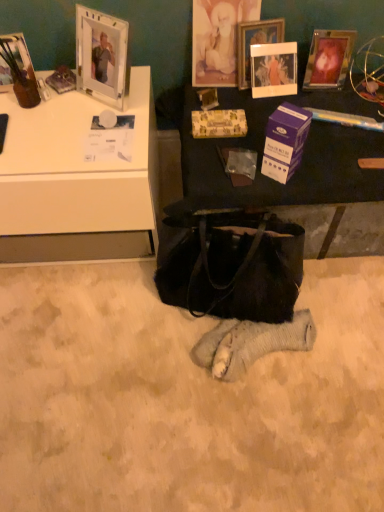
Identify the location of vacant point above matte black table at center (from a real-world perspective). (244, 105).